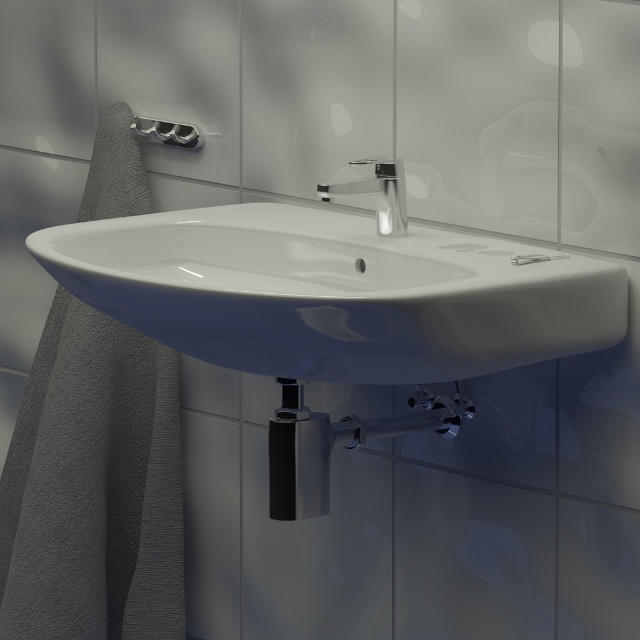
Question: Is white glossy sink at center wider than polished chrome faucet at center?

Choices:
 (A) no
 (B) yes

Answer: (B)

Question: Which object is closer to the camera taking this photo?

Choices:
 (A) polished chrome faucet at center
 (B) white glossy sink at center

Answer: (B)

Question: Can you confirm if polished chrome faucet at center is positioned above brushed metal towel bar at upper left?

Choices:
 (A) yes
 (B) no

Answer: (B)

Question: Which of the following is the farthest from the observer?

Choices:
 (A) (186, 147)
 (B) (378, 186)
 (C) (275, 308)

Answer: (A)

Question: Does polished chrome faucet at center appear on the left side of brushed metal towel bar at upper left?

Choices:
 (A) no
 (B) yes

Answer: (A)

Question: Which point is closer to the camera?

Choices:
 (A) 145,125
 (B) 324,189

Answer: (B)